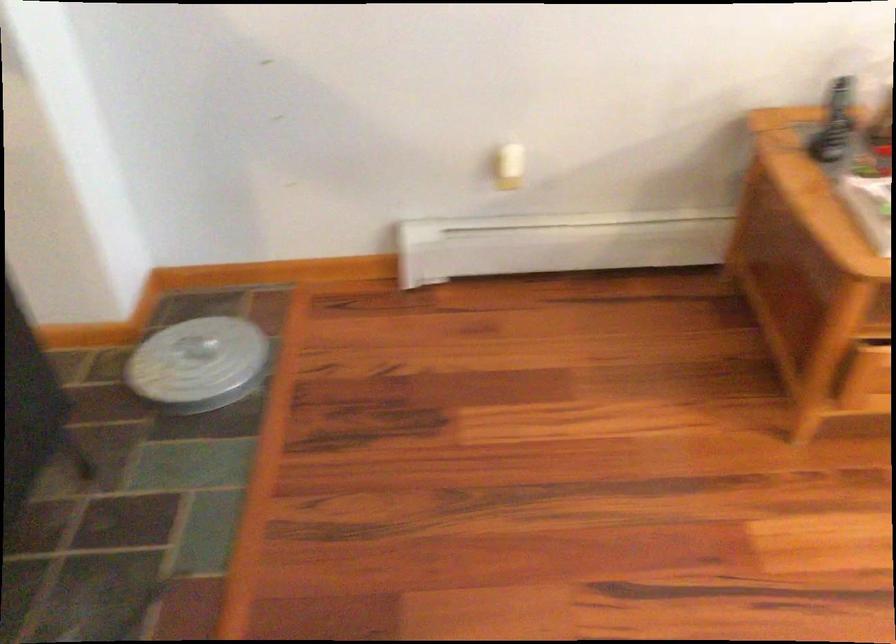
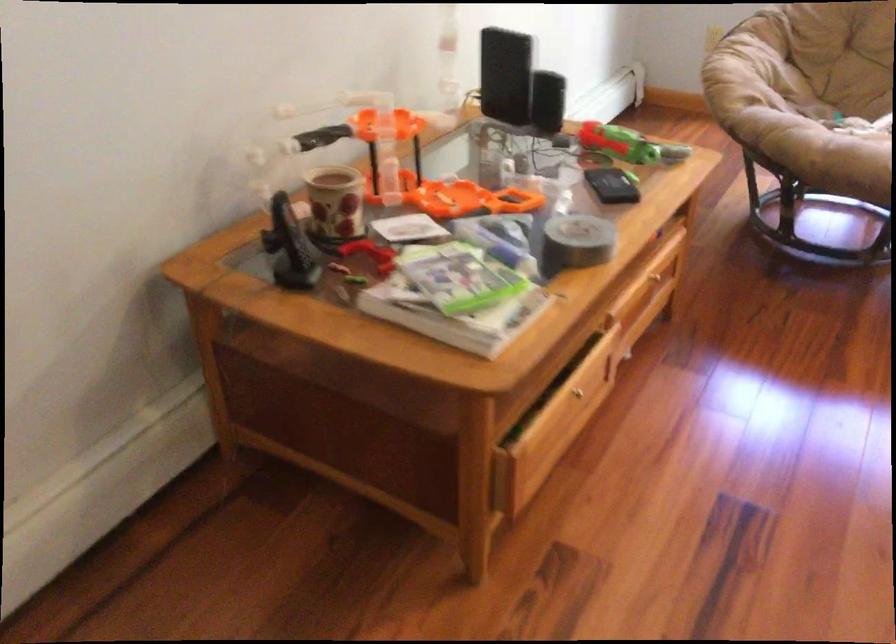
Question: The images are taken continuously from a first-person perspective. In which direction is your viewpoint rotating?

Choices:
 (A) Left
 (B) Right
 (C) Up
 (D) Down

Answer: (B)